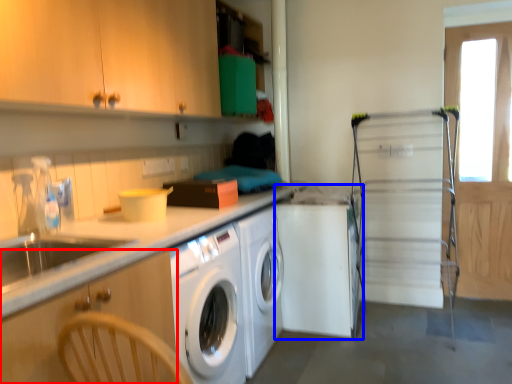
Question: Which object appears closest to the camera in this image, cabinetry (highlighted by a red box) or washing machine (highlighted by a blue box)?

Choices:
 (A) cabinetry
 (B) washing machine

Answer: (A)